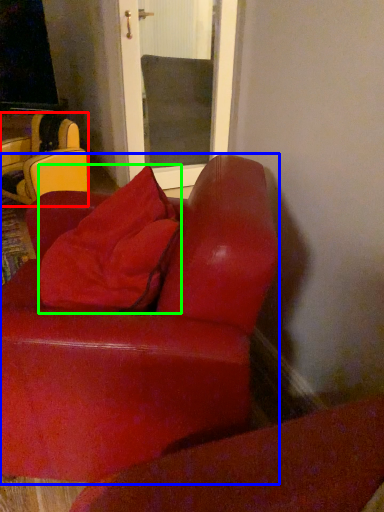
Question: Based on their relative distances, which object is nearer to chair (highlighted by a red box)? Choose from studio couch (highlighted by a blue box) and throw pillow (highlighted by a green box).

Choices:
 (A) studio couch
 (B) throw pillow

Answer: (B)